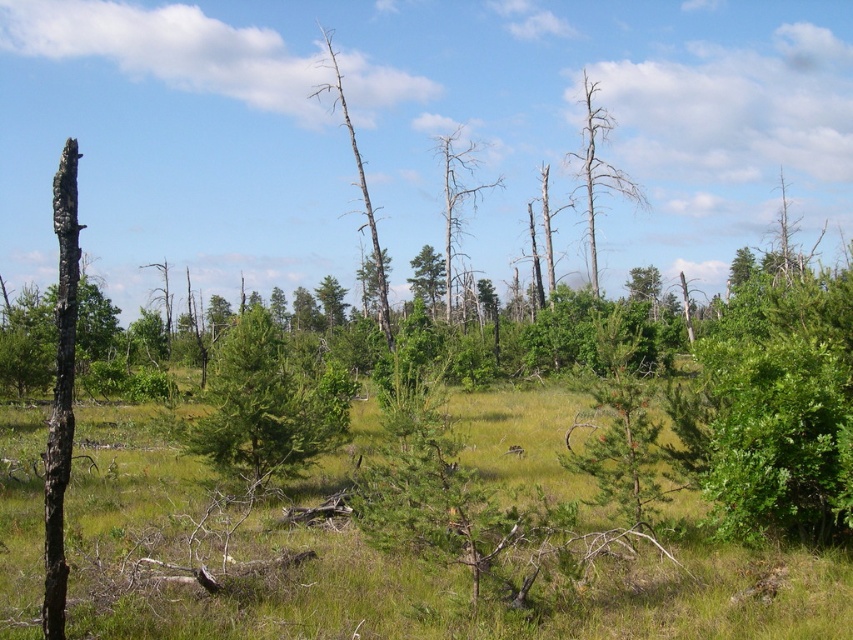
Question: Which of the following is the farthest from the observer?

Choices:
 (A) (213, 442)
 (B) (592, 145)

Answer: (B)

Question: Can you confirm if dead wood tree at center is positioned below bare wood tree at center?

Choices:
 (A) yes
 (B) no

Answer: (A)

Question: Which point appears closest to the camera in this image?

Choices:
 (A) (340, 84)
 (B) (315, 422)
 (C) (595, 176)
 (D) (451, 193)

Answer: (B)

Question: Is dead wood tree at center further to the viewer compared to bare wood tree at center?

Choices:
 (A) no
 (B) yes

Answer: (B)

Question: Which of the following is the farthest from the observer?

Choices:
 (A) dead wood tree at center
 (B) green matte tree at center
 (C) dead wood tree at upper right

Answer: (A)

Question: Is dead wood tree at center further to the viewer compared to bare wood tree at center?

Choices:
 (A) no
 (B) yes

Answer: (B)